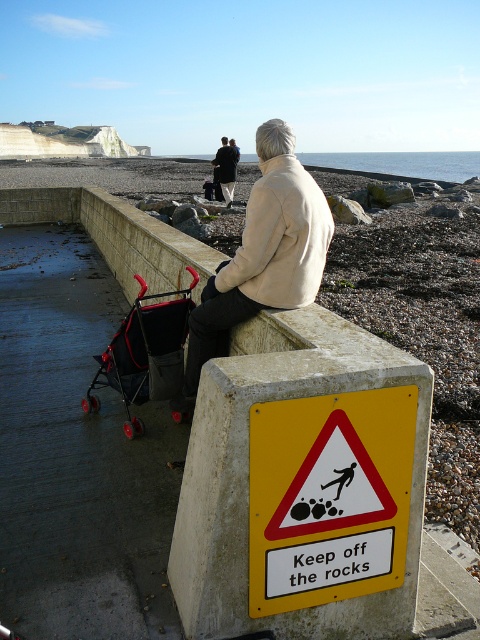
You are standing at the point marked by coordinates point [314,557] and want to take a photo of the scene. If your camera can capture a clear image up to 2 meters away, will you be able to capture the entire scene from your current position?

The distance between point [314,557] and the camera is 1.98 meters, which is within the camera range of 2 meters. Therefore, you can capture the entire scene from your current position.